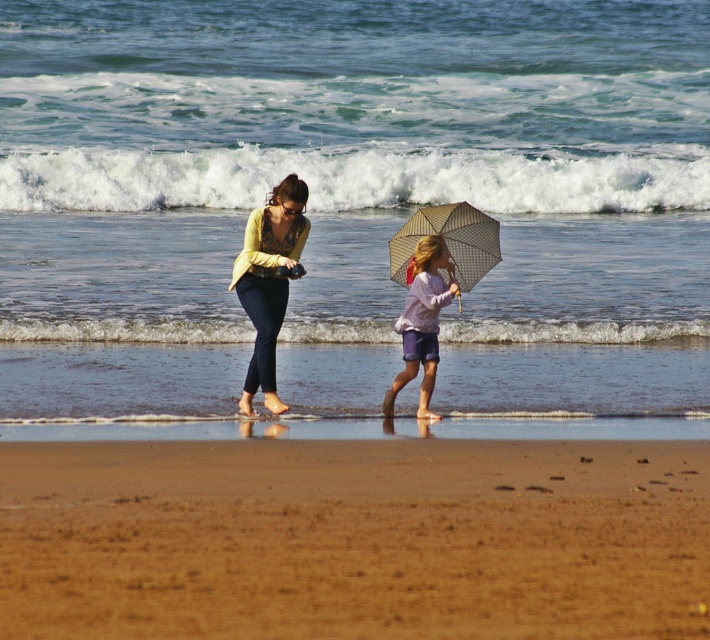
You are planning to set up a picnic on the beach. You have the brown sandy beach at lower center and the checkered fabric umbrella at center. Which area is more suitable for placing the picnic blanket?

The brown sandy beach at lower center is more suitable for placing the picnic blanket because it has a larger size compared to the checkered fabric umbrella at center.

You are a photographer standing on the beach and want to capture a photo of the matte yellow sweater at center and the light purple fabric umbrella at center. Which object should you focus on first if you want to ensure both are in focus?

The matte yellow sweater at center is positioned over the light purple fabric umbrella at center, so focusing on the matte yellow sweater at center first will ensure both are in focus since it is closer to the camera.

In the scene shown: You are standing at the beach and see two points marked on the sand. The first point is at coordinates point (251, 362) and the second is at point (457, 264). Which point is closer to you?

The point (251, 362) is closer to you than the point (457, 264).